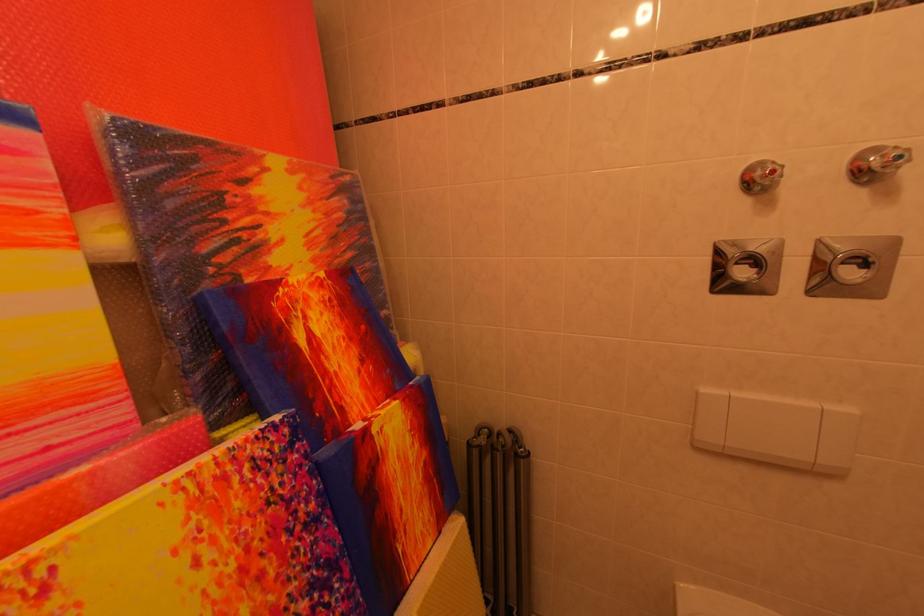
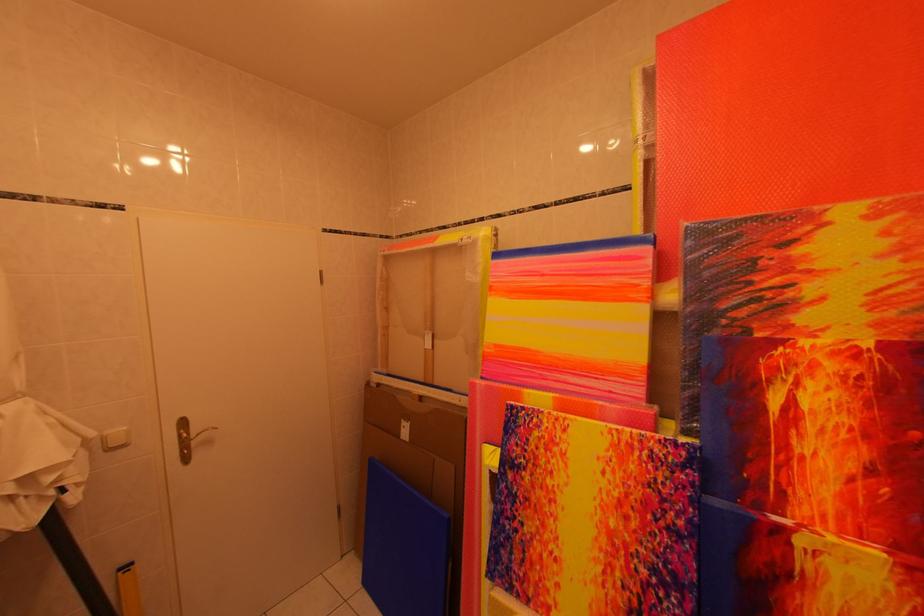
Question: The first image is from the beginning of the video and the second image is from the end. How did the camera likely rotate when shooting the video?

Choices:
 (A) Left
 (B) Right
 (C) Up
 (D) Down

Answer: (A)